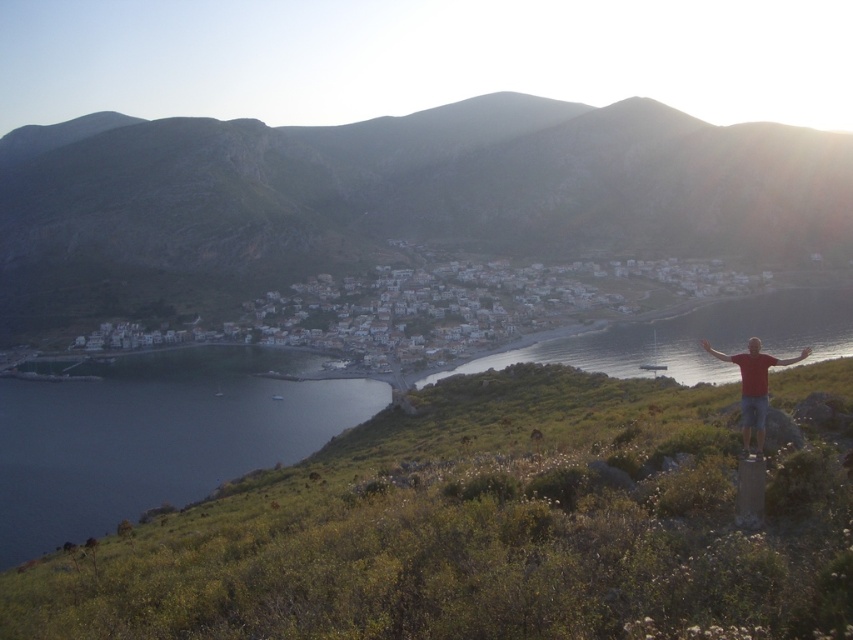
You are a photographer wanting to capture the red cotton shirt at lower right and the red matte arm at right in your shot. Which object should you focus on first if you want to ensure both are in focus?

The red cotton shirt at lower right is above the red matte arm at right, so focusing on the red cotton shirt at lower right first will help ensure both are in focus as they are vertically aligned.

You are standing at the camera position and want to throw a ball to the dark blue water at lower left. Can you reach it without moving from your current position?

The dark blue water at lower left is 279.76 feet away from the camera, so you cannot reach it by throwing a ball from the camera position without moving.